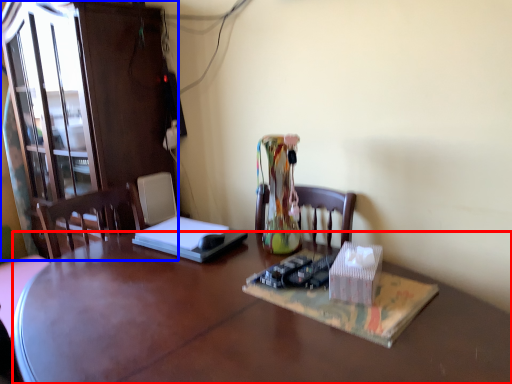
Question: Which object appears closest to the camera in this image, desk (highlighted by a red box) or cabinetry (highlighted by a blue box)?

Choices:
 (A) desk
 (B) cabinetry

Answer: (A)